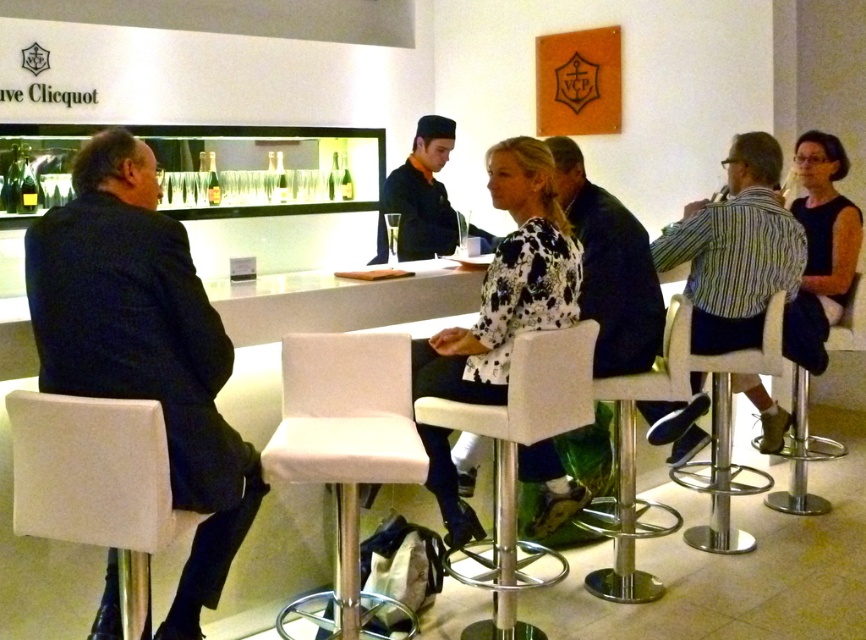
Question: Which of these objects is positioned closest to the dark blue uniform at center?

Choices:
 (A) striped cotton shirt at right
 (B) white fabric stool at center
 (C) polished chrome bar stool at center

Answer: (A)

Question: Which point is closer to the camera taking this photo?

Choices:
 (A) (508, 605)
 (B) (107, 472)
 (C) (766, 156)
 (D) (553, 307)

Answer: (B)

Question: Is white fabric bar stool at lower left bigger than striped cotton shirt at right?

Choices:
 (A) yes
 (B) no

Answer: (B)

Question: Which of the following is the farthest from the observer?

Choices:
 (A) (759, 401)
 (B) (115, 442)
 (C) (372, 440)

Answer: (A)

Question: Can you confirm if striped cotton shirt at right is positioned to the right of dark blue shirt at center?

Choices:
 (A) no
 (B) yes

Answer: (B)

Question: Does white fabric stool at center appear on the left side of metallic silver bar stool at center?

Choices:
 (A) yes
 (B) no

Answer: (A)